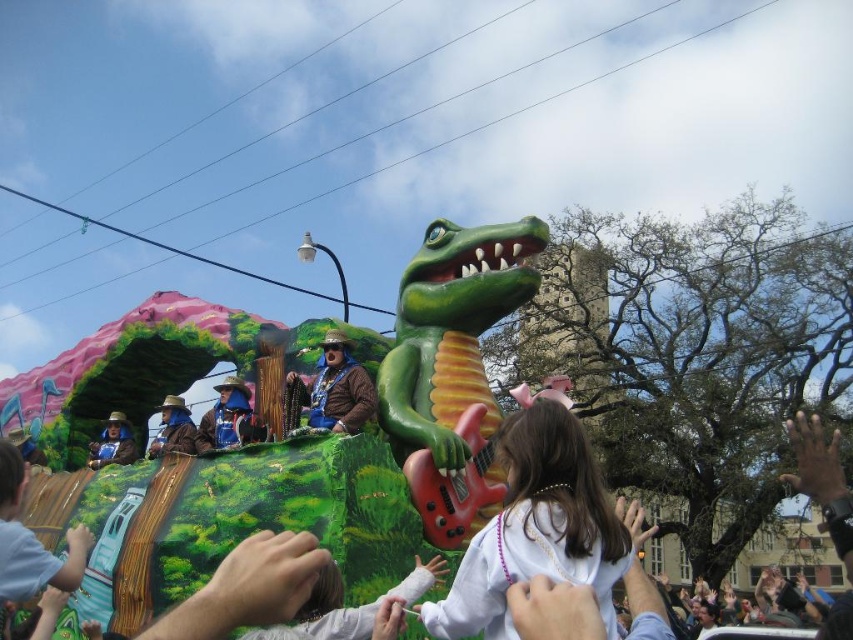
Question: Is white pearl necklace at center above brown felt hat at center?

Choices:
 (A) no
 (B) yes

Answer: (A)

Question: Among these points, which one is farthest from the camera?

Choices:
 (A) (584, 490)
 (B) (219, 433)
 (C) (370, 385)

Answer: (B)

Question: Which point appears farthest from the camera in this image?

Choices:
 (A) (367, 404)
 (B) (227, 412)
 (C) (608, 513)
 (D) (186, 406)

Answer: (D)

Question: Can you confirm if brown leather jacket at center is positioned below brown felt hat at center?

Choices:
 (A) yes
 (B) no

Answer: (B)

Question: Is the position of white pearl necklace at center less distant than that of brown leather jacket at center?

Choices:
 (A) no
 (B) yes

Answer: (B)

Question: Estimate the real-world distances between objects in this image. Which object is farther from the brown felt hat at center?

Choices:
 (A) blue fabric hat at center
 (B) blue velvet hat at center
 (C) white pearl necklace at center
 (D) brown leather jacket at center

Answer: (C)